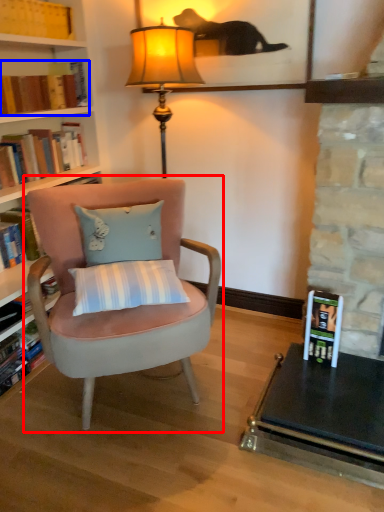
Question: Which object appears farthest to the camera in this image, chair (highlighted by a red box) or book (highlighted by a blue box)?

Choices:
 (A) chair
 (B) book

Answer: (B)